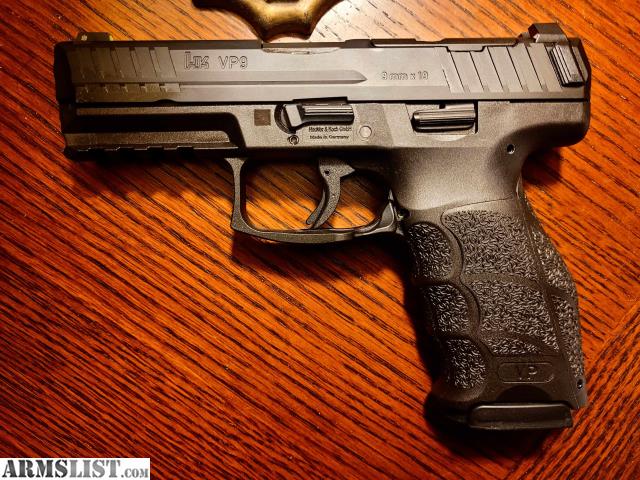
Locate an element on the screen. This screenshot has height=480, width=640. table is located at coordinates (294, 388).